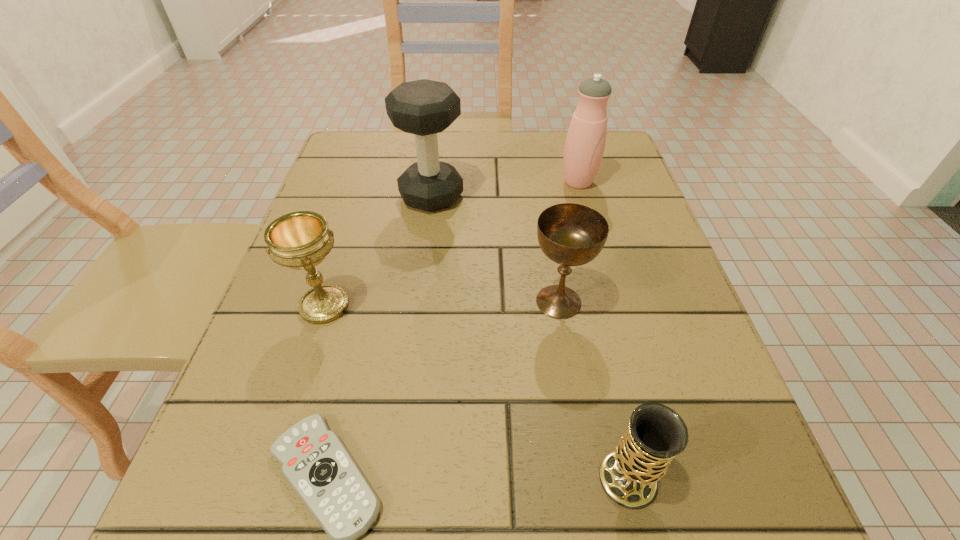
Locate an element on the screen. The height and width of the screenshot is (540, 960). vacant space at the right edge of the desktop is located at coordinates (667, 315).

At what (x,y) coordinates should I click in order to perform the action: click on vacant space at the far left corner of the desktop. Please return your answer as a coordinate pair (x, y). Looking at the image, I should click on (348, 173).

Locate an element on the screen. free space at the near right corner of the desktop is located at coordinates (772, 494).

Image resolution: width=960 pixels, height=540 pixels. Identify the location of free space that is in between the leftmost chalice and the nearest chalice. (476, 393).

The width and height of the screenshot is (960, 540). In order to click on vacant point located between the second shortest object and the dumbbell in this screenshot , I will do `click(530, 338)`.

Locate an element on the screen. This screenshot has height=540, width=960. free point between the nearest chalice and the thermos bottle is located at coordinates (603, 330).

Locate an element on the screen. Image resolution: width=960 pixels, height=540 pixels. vacant area between the shortest chalice and the dumbbell is located at coordinates (530, 338).

In order to click on the second closest object to the dumbbell in this screenshot , I will do (x=585, y=142).

The width and height of the screenshot is (960, 540). I want to click on object that is the fourth closest to the shortest chalice, so click(x=424, y=108).

Select which chalice is the closest to the thermos bottle. Please provide its 2D coordinates. Your answer should be formatted as a tuple, i.e. [(x, y)], where the tuple contains the x and y coordinates of a point satisfying the conditions above.

[(569, 234)]